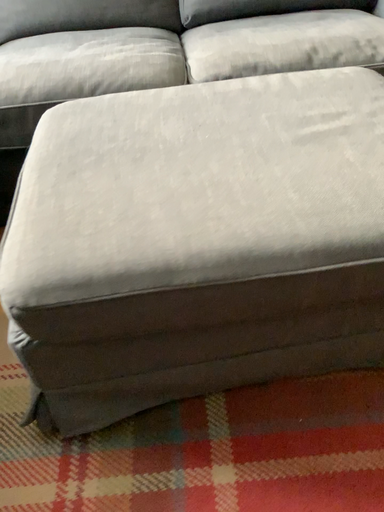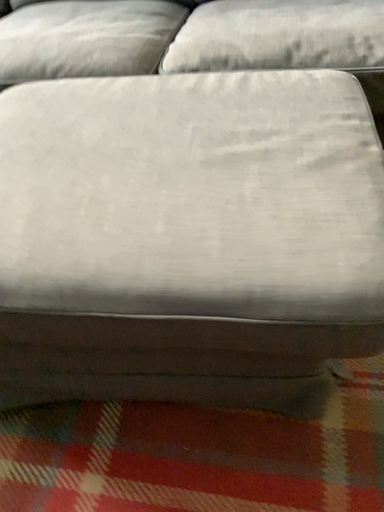
Question: Which way did the camera rotate in the video?

Choices:
 (A) rotated right
 (B) rotated left

Answer: (B)